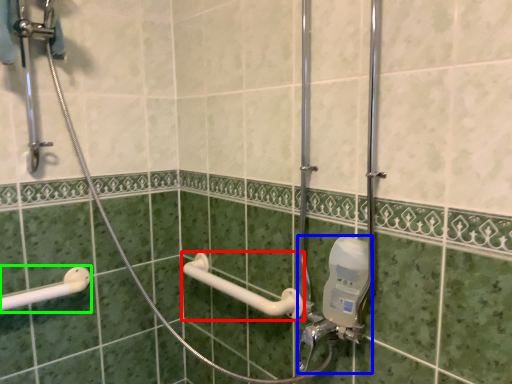
Question: Which object is positioned closest to towel bar (highlighted by a red box)? Select from plumbing fixture (highlighted by a blue box) and shower (highlighted by a green box).

Choices:
 (A) plumbing fixture
 (B) shower

Answer: (A)